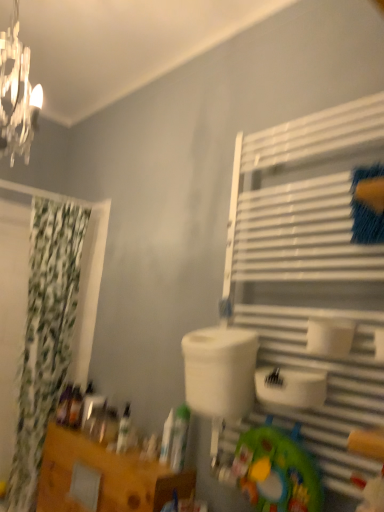
Question: From the image's perspective, is green fabric curtain at left on translucent plastic bottle at lower left, which ranks as the first toiletry in back-to-front order?

Choices:
 (A) yes
 (B) no

Answer: (A)

Question: Does green fabric curtain at left have a lesser width compared to translucent plastic bottle at lower left, marked as the 1th toiletry in a left-to-right arrangement?

Choices:
 (A) no
 (B) yes

Answer: (A)

Question: Is the surface of green fabric curtain at left in direct contact with translucent plastic bottle at lower left, the fifth toiletry from the right?

Choices:
 (A) yes
 (B) no

Answer: (B)

Question: Is green fabric curtain at left positioned with its back to translucent plastic bottle at lower left, which ranks as the first toiletry in back-to-front order?

Choices:
 (A) no
 (B) yes

Answer: (B)

Question: Considering the relative sizes of green fabric curtain at left and translucent plastic bottle at lower left, marked as the 1th toiletry in a left-to-right arrangement, in the image provided, is green fabric curtain at left wider than translucent plastic bottle at lower left, marked as the 1th toiletry in a left-to-right arrangement,?

Choices:
 (A) yes
 (B) no

Answer: (A)

Question: Looking at the image, does green fabric curtain at left seem bigger or smaller compared to white metal shelf at right?

Choices:
 (A) small
 (B) big

Answer: (B)

Question: Considering the relative positions of green fabric curtain at left and white metal shelf at right in the image provided, is green fabric curtain at left to the left or to the right of white metal shelf at right?

Choices:
 (A) right
 (B) left

Answer: (B)

Question: In the image, is green fabric curtain at left positioned in front of or behind white metal shelf at right?

Choices:
 (A) front
 (B) behind

Answer: (B)

Question: Is green fabric curtain at left spatially inside white metal shelf at right, or outside of it?

Choices:
 (A) outside
 (B) inside

Answer: (A)

Question: Is white matte bottle at center, acting as the second toiletry starting from the right, wider or thinner than translucent plastic bottle at lower left, which ranks as the 2th toiletry in left-to-right order?

Choices:
 (A) thin
 (B) wide

Answer: (A)

Question: Is white matte bottle at center, the 4th toiletry positioned from the back, inside the boundaries of translucent plastic bottle at lower left, marked as the fourth toiletry in a right-to-left arrangement, or outside?

Choices:
 (A) inside
 (B) outside

Answer: (B)

Question: Is point (168, 450) positioned closer to the camera than point (79, 403)?

Choices:
 (A) farther
 (B) closer

Answer: (B)

Question: From a real-world perspective, is white matte bottle at center, which is the second toiletry in front-to-back order, positioned above or below translucent plastic bottle at lower left, which ranks as the 2th toiletry in left-to-right order?

Choices:
 (A) below
 (B) above

Answer: (A)

Question: Based on their positions, is white metal shelf at right located to the left or right of white matte bottle at lower left, marked as the 3th toiletry in a left-to-right arrangement?

Choices:
 (A) right
 (B) left

Answer: (A)

Question: In the image, is white metal shelf at right positioned in front of or behind white matte bottle at lower left, placed as the third toiletry when sorted from front to back?

Choices:
 (A) behind
 (B) front

Answer: (B)